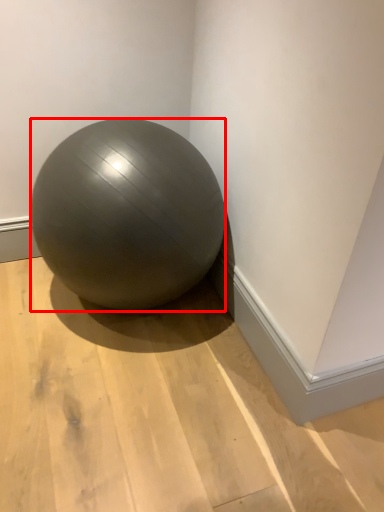
Question: From the image's perspective, what is the correct spatial positioning of ball (annotated by the red box) in reference to surface?

Choices:
 (A) below
 (B) above

Answer: (B)